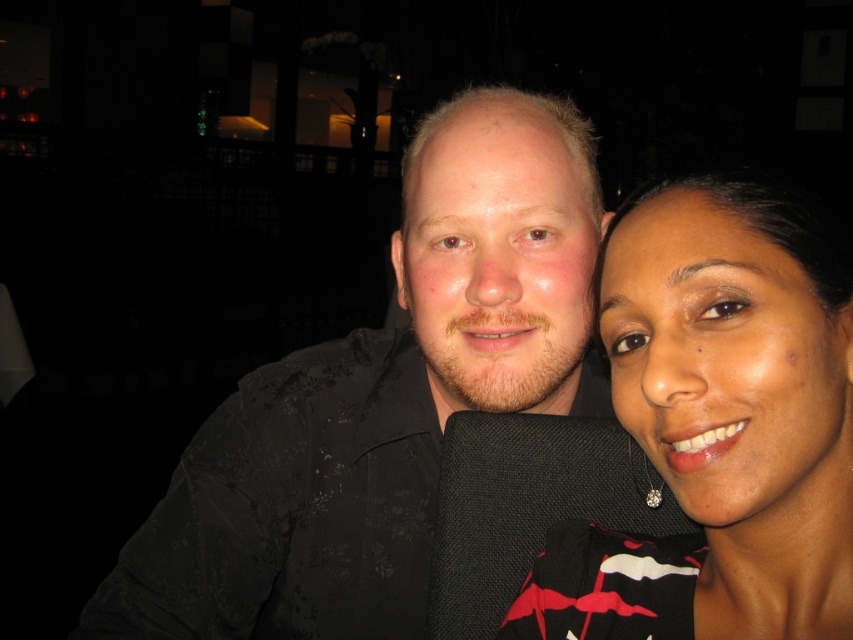
Question: Does black textured shirt at center appear on the right side of matte black dress at right?

Choices:
 (A) yes
 (B) no

Answer: (B)

Question: Does black textured shirt at center appear on the left side of matte black dress at right?

Choices:
 (A) yes
 (B) no

Answer: (A)

Question: Is black textured shirt at center below matte black dress at right?

Choices:
 (A) yes
 (B) no

Answer: (A)

Question: Which object appears farthest from the camera in this image?

Choices:
 (A) black textured shirt at center
 (B) matte black dress at right

Answer: (A)

Question: Which point is farther to the camera?

Choices:
 (A) black textured shirt at center
 (B) matte black dress at right

Answer: (A)